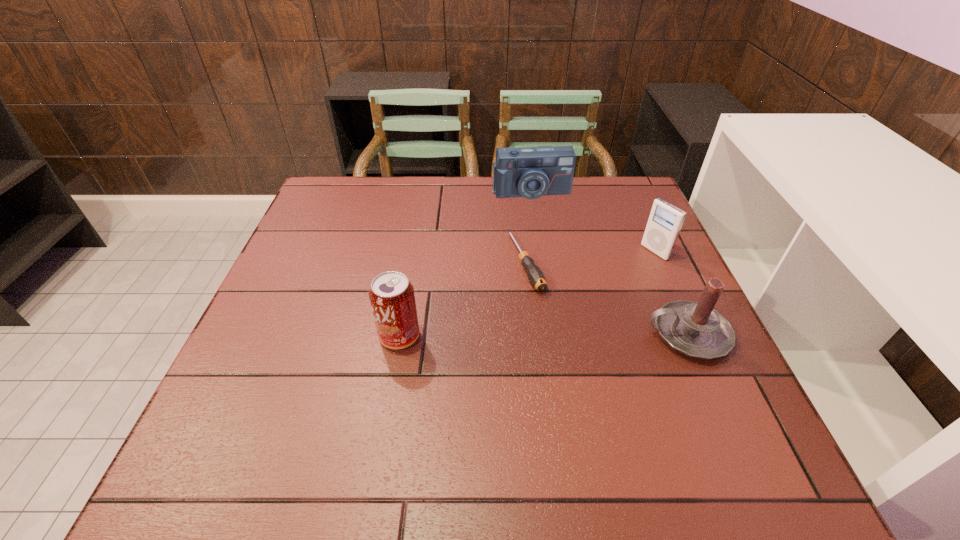
Where is `vacant area that lies between the candle and the leftmost object`? vacant area that lies between the candle and the leftmost object is located at coordinates (543, 335).

The height and width of the screenshot is (540, 960). Identify the location of empty space that is in between the iPod and the screwdriver. (590, 257).

Where is `vacant area that lies between the iPod and the shortest object`? Image resolution: width=960 pixels, height=540 pixels. vacant area that lies between the iPod and the shortest object is located at coordinates (590, 257).

At what (x,y) coordinates should I click in order to perform the action: click on vacant space in between the camera and the iPod. Please return your answer as a coordinate pair (x, y). Looking at the image, I should click on (593, 222).

At what (x,y) coordinates should I click in order to perform the action: click on vacant space that is in between the iPod and the soda can. Please return your answer as a coordinate pair (x, y). The width and height of the screenshot is (960, 540). Looking at the image, I should click on (527, 294).

Where is `free spot between the iPod and the shortest object`? free spot between the iPod and the shortest object is located at coordinates (590, 257).

Find the location of `empty space that is in between the leftmost object and the screwdriver`. empty space that is in between the leftmost object and the screwdriver is located at coordinates (463, 299).

Find the location of a particular element. object that stands as the closest to the screwdriver is located at coordinates (531, 172).

Identify the location of the second closest object to the farthest object. The image size is (960, 540). (665, 221).

At what (x,y) coordinates should I click in order to perform the action: click on blank space that satisfies the following two spatial constraints: 1. on the front side of the shortest object; 2. on the side of the candle with the handle loop. Please return your answer as a coordinate pair (x, y). The image size is (960, 540). Looking at the image, I should click on (534, 334).